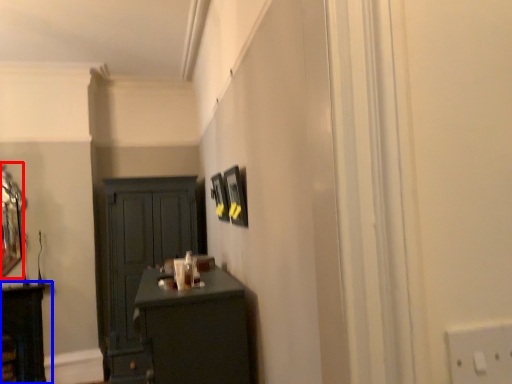
Question: Among these objects, which one is farthest to the camera, mirror (highlighted by a red box) or cabinetry (highlighted by a blue box)?

Choices:
 (A) mirror
 (B) cabinetry

Answer: (A)